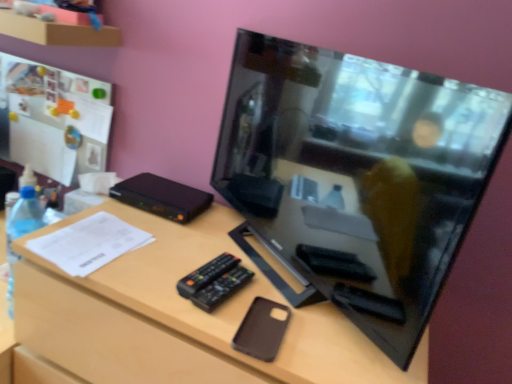
Identify the location of spots to the right of brown matte phone case at center. (331, 340).